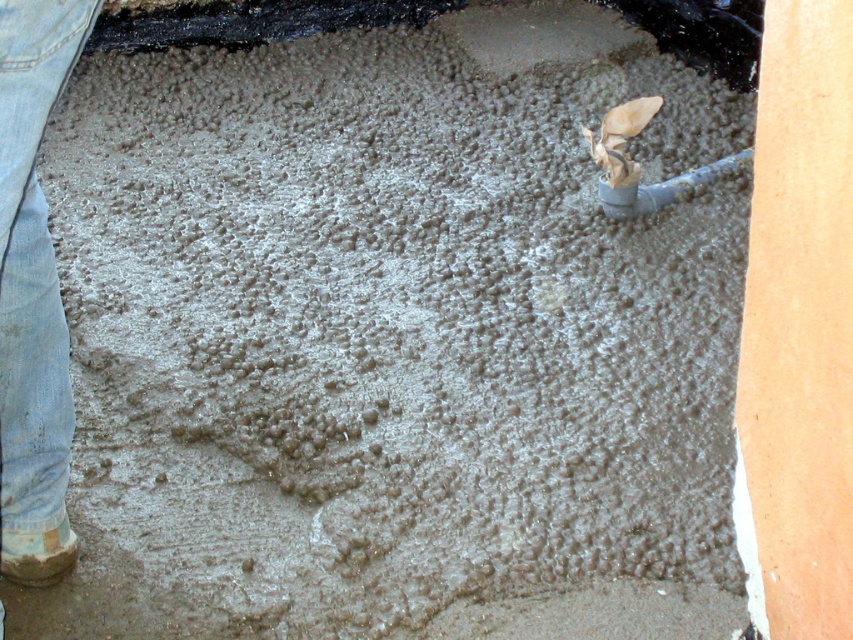
Question: Is denim jeans at lower left bigger than brown fur chihuahua at upper center?

Choices:
 (A) no
 (B) yes

Answer: (B)

Question: Among these objects, which one is nearest to the camera?

Choices:
 (A) brown fur chihuahua at upper center
 (B) denim jeans at lower left

Answer: (B)

Question: Does denim jeans at lower left appear under brown fur chihuahua at upper center?

Choices:
 (A) yes
 (B) no

Answer: (A)

Question: Which of the following is the farthest from the observer?

Choices:
 (A) brown fur chihuahua at upper center
 (B) denim jeans at lower left

Answer: (A)

Question: Can you confirm if denim jeans at lower left is positioned to the right of brown fur chihuahua at upper center?

Choices:
 (A) yes
 (B) no

Answer: (B)